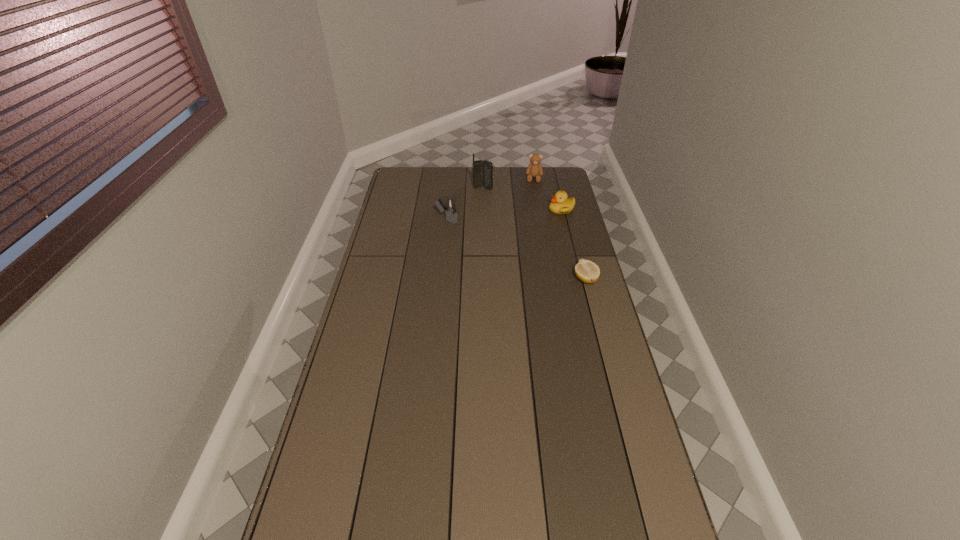
The height and width of the screenshot is (540, 960). In order to click on lemon that is at the right edge in this screenshot , I will do `click(587, 271)`.

Locate an element on the screen. This screenshot has width=960, height=540. duckling located at the right edge is located at coordinates (560, 204).

Locate an element on the screen. This screenshot has height=540, width=960. teddy bear located at the right edge is located at coordinates (534, 169).

The height and width of the screenshot is (540, 960). Find the location of `object that is at the far right corner`. object that is at the far right corner is located at coordinates (534, 169).

This screenshot has height=540, width=960. In order to click on vacant space at the far edge of the desktop in this screenshot , I will do `click(504, 177)`.

Identify the location of vacant space at the near edge. Image resolution: width=960 pixels, height=540 pixels. (464, 524).

Locate an element on the screen. This screenshot has width=960, height=540. vacant region at the left edge is located at coordinates (372, 255).

Find the location of a particular element. Image resolution: width=960 pixels, height=540 pixels. vacant area at the right edge of the desktop is located at coordinates (566, 273).

Locate an element on the screen. The width and height of the screenshot is (960, 540). free space at the far left corner of the desktop is located at coordinates (404, 173).

In the image, there is a desktop. Identify the location of vacant space at the near right corner. The height and width of the screenshot is (540, 960). (632, 516).